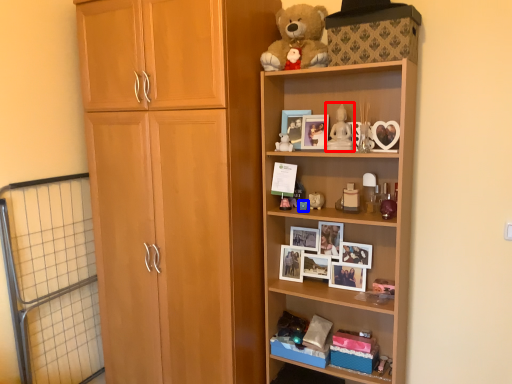
Question: Which point is further to the camera, toy (highlighted by a red box) or toy (highlighted by a blue box)?

Choices:
 (A) toy
 (B) toy

Answer: (B)